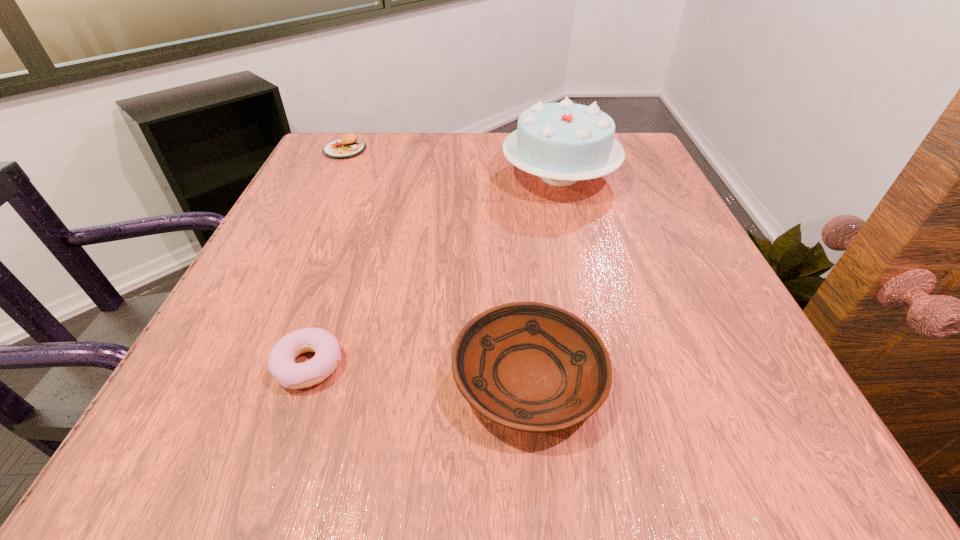
The image size is (960, 540). I want to click on vacant point located between the birthday cake and the plate, so click(544, 277).

At what (x,y) coordinates should I click in order to perform the action: click on free space between the tallest object and the patty. Please return your answer as a coordinate pair (x, y). Image resolution: width=960 pixels, height=540 pixels. Looking at the image, I should click on (452, 163).

Locate an element on the screen. the second closest object to the plate is located at coordinates (562, 143).

Select which object appears as the second closest to the plate. Please provide its 2D coordinates. Your answer should be formatted as a tuple, i.e. [(x, y)], where the tuple contains the x and y coordinates of a point satisfying the conditions above.

[(562, 143)]

This screenshot has height=540, width=960. Find the location of `free spot that satisfies the following two spatial constraints: 1. on the front side of the doughnut; 2. on the right side of the plate`. free spot that satisfies the following two spatial constraints: 1. on the front side of the doughnut; 2. on the right side of the plate is located at coordinates (304, 378).

The height and width of the screenshot is (540, 960). I want to click on vacant space that satisfies the following two spatial constraints: 1. on the back side of the plate; 2. on the left side of the tallest object, so click(x=510, y=176).